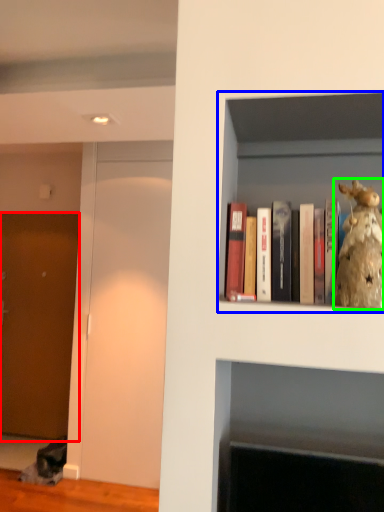
Question: Which object is the farthest from door (highlighted by a red box)? Choose among these: shelf (highlighted by a blue box) or figurine (highlighted by a green box).

Choices:
 (A) shelf
 (B) figurine

Answer: (B)